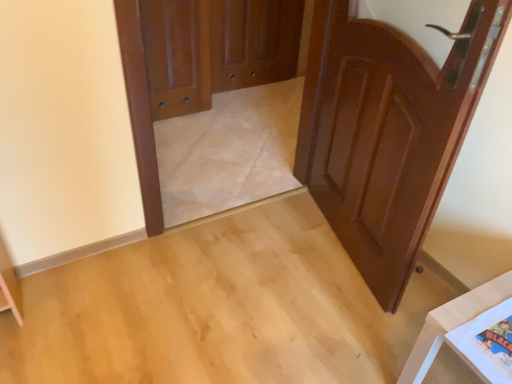
Find the location of a particular element. This screenshot has height=384, width=512. vacant region in front of shiny brown door at right, which appears as the 1th door when viewed from the right is located at coordinates (324, 320).